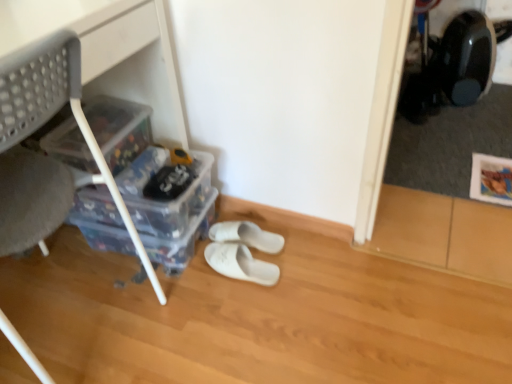
This screenshot has width=512, height=384. Identify the location of vacant area located to the right-hand side of white plastic chair at left. (201, 323).